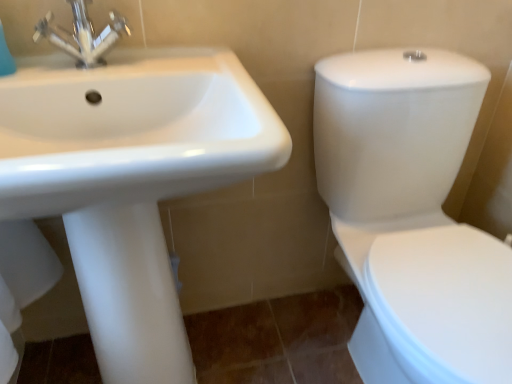
Question: Can you confirm if white glossy sink at upper left is positioned to the right of metallic chrome faucet at upper left?

Choices:
 (A) no
 (B) yes

Answer: (B)

Question: Considering the relative sizes of white glossy sink at upper left and metallic chrome faucet at upper left in the image provided, is white glossy sink at upper left taller than metallic chrome faucet at upper left?

Choices:
 (A) yes
 (B) no

Answer: (A)

Question: Is white glossy sink at upper left looking in the opposite direction of metallic chrome faucet at upper left?

Choices:
 (A) yes
 (B) no

Answer: (B)

Question: Does white glossy sink at upper left have a lesser width compared to metallic chrome faucet at upper left?

Choices:
 (A) yes
 (B) no

Answer: (B)

Question: Is white glossy sink at upper left outside metallic chrome faucet at upper left?

Choices:
 (A) yes
 (B) no

Answer: (A)

Question: Considering the relative positions of white glossy toilet at right and metallic chrome faucet at upper left in the image provided, is white glossy toilet at right to the left or to the right of metallic chrome faucet at upper left?

Choices:
 (A) left
 (B) right

Answer: (B)

Question: From the image's perspective, relative to metallic chrome faucet at upper left, is white glossy toilet at right above or below?

Choices:
 (A) below
 (B) above

Answer: (A)

Question: Is white glossy toilet at right taller or shorter than metallic chrome faucet at upper left?

Choices:
 (A) short
 (B) tall

Answer: (B)

Question: Based on their sizes in the image, would you say white glossy toilet at right is bigger or smaller than metallic chrome faucet at upper left?

Choices:
 (A) big
 (B) small

Answer: (A)

Question: From a real-world perspective, relative to white glossy sink at upper left, is metallic chrome faucet at upper left vertically above or below?

Choices:
 (A) below
 (B) above

Answer: (B)

Question: Is metallic chrome faucet at upper left bigger or smaller than white glossy sink at upper left?

Choices:
 (A) big
 (B) small

Answer: (B)

Question: Considering the positions of metallic chrome faucet at upper left and white glossy sink at upper left in the image, is metallic chrome faucet at upper left wider or thinner than white glossy sink at upper left?

Choices:
 (A) wide
 (B) thin

Answer: (B)

Question: Is metallic chrome faucet at upper left taller or shorter than white glossy sink at upper left?

Choices:
 (A) tall
 (B) short

Answer: (B)

Question: Is white glossy toilet at right situated inside white glossy sink at upper left or outside?

Choices:
 (A) outside
 (B) inside

Answer: (A)

Question: Considering the positions of white glossy toilet at right and white glossy sink at upper left in the image, is white glossy toilet at right bigger or smaller than white glossy sink at upper left?

Choices:
 (A) small
 (B) big

Answer: (B)